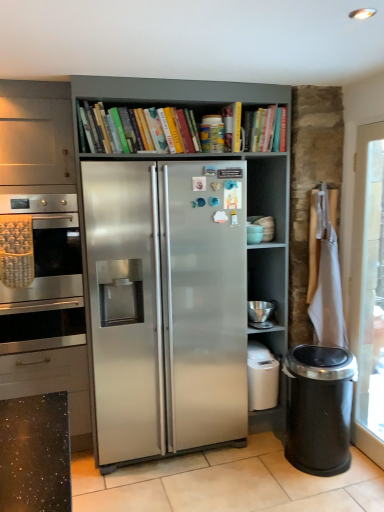
The image size is (384, 512). I want to click on free space that is in between satin silver fridge at center and black plastic trash can at lower right, so click(x=227, y=466).